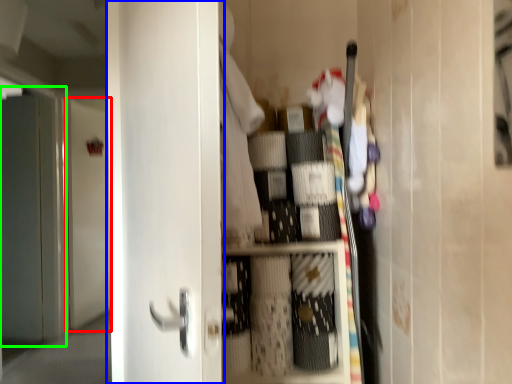
Question: Estimate the real-world distances between objects in this image. Which object is closer to door (highlighted by a red box), door (highlighted by a blue box) or screen door (highlighted by a green box)?

Choices:
 (A) door
 (B) screen door

Answer: (B)